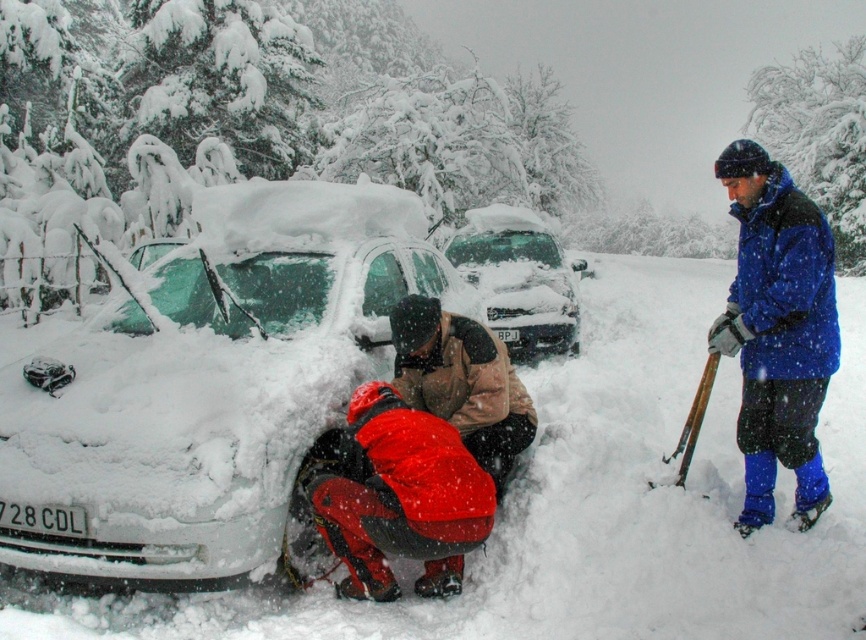
What do you see at coordinates (590, 506) in the screenshot? I see `white fluffy snow at lower left` at bounding box center [590, 506].

Based on the photo, does white fluffy snow at lower left lie in front of green metallic shovel at right?

Yes, white fluffy snow at lower left is closer to the viewer.

Is point (250, 621) positioned behind point (699, 413)?

No, it is not.

Find the location of a particular element. This screenshot has width=866, height=640. white fluffy snow at lower left is located at coordinates (590, 506).

Does white matte car at center have a greater width compared to green metallic shovel at right?

Correct, the width of white matte car at center exceeds that of green metallic shovel at right.

Who is higher up, white matte car at center or green metallic shovel at right?

white matte car at center is above.

What do you see at coordinates (214, 388) in the screenshot? The image size is (866, 640). I see `white matte car at center` at bounding box center [214, 388].

I want to click on white matte car at center, so click(214, 388).

Is white matte car at center thinner than blue fleece jacket at right?

No, white matte car at center is not thinner than blue fleece jacket at right.

Locate an element on the screen. The image size is (866, 640). white matte car at center is located at coordinates (214, 388).

Where is `white matte car at center`? This screenshot has height=640, width=866. white matte car at center is located at coordinates (214, 388).